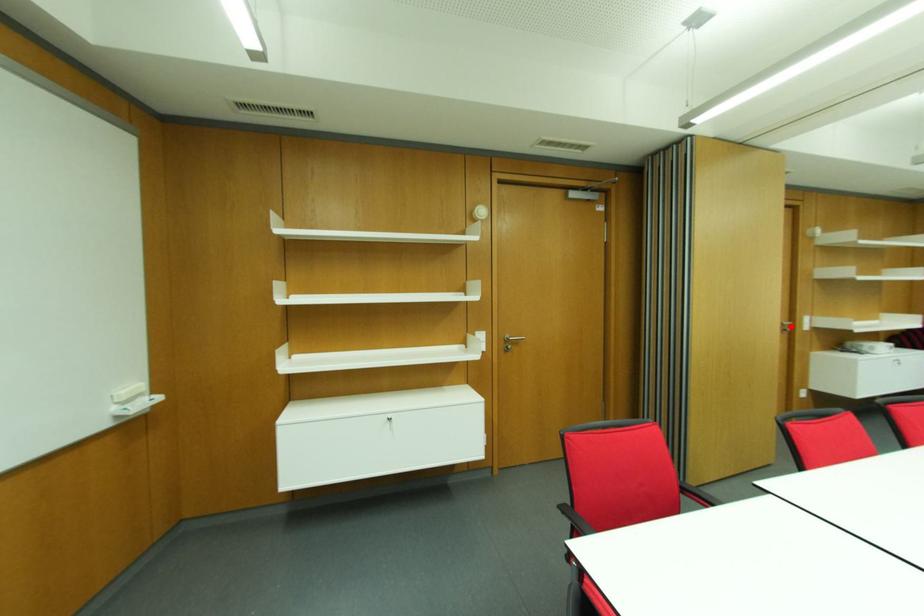
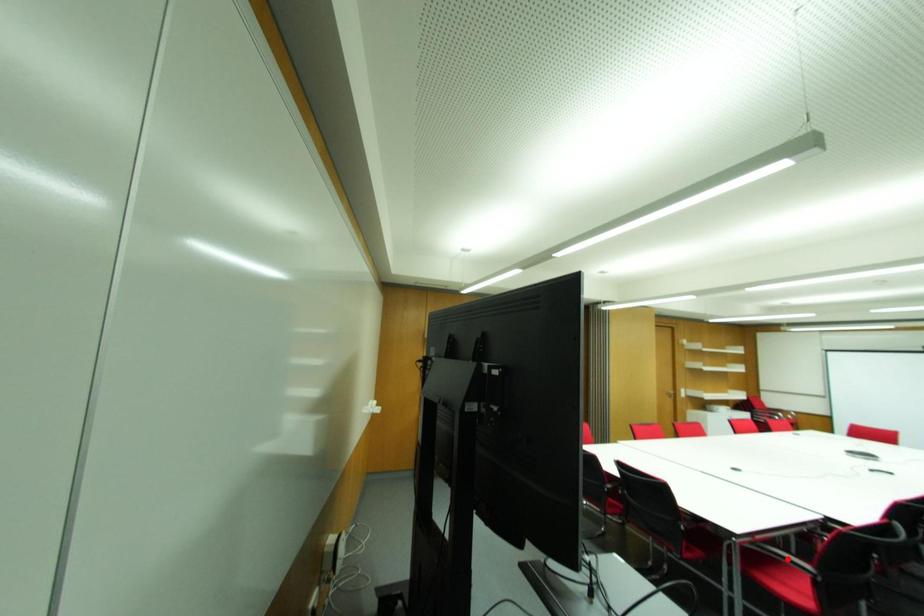
I am providing you with two images of the same scene from different viewpoints. A red point is marked on the first image and another point is marked on the second image. Do the highlighted points in image1 and image2 indicate the same real-world spot?

No